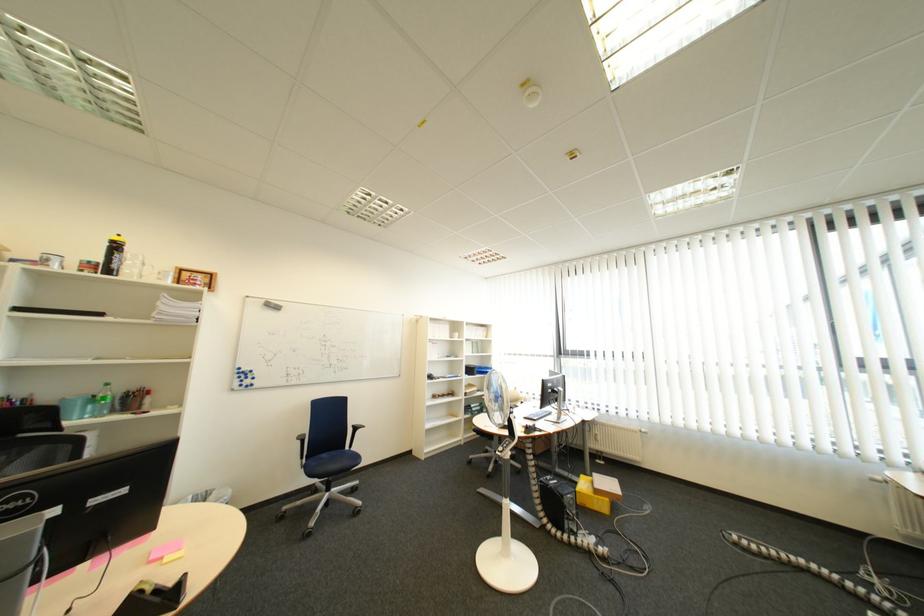
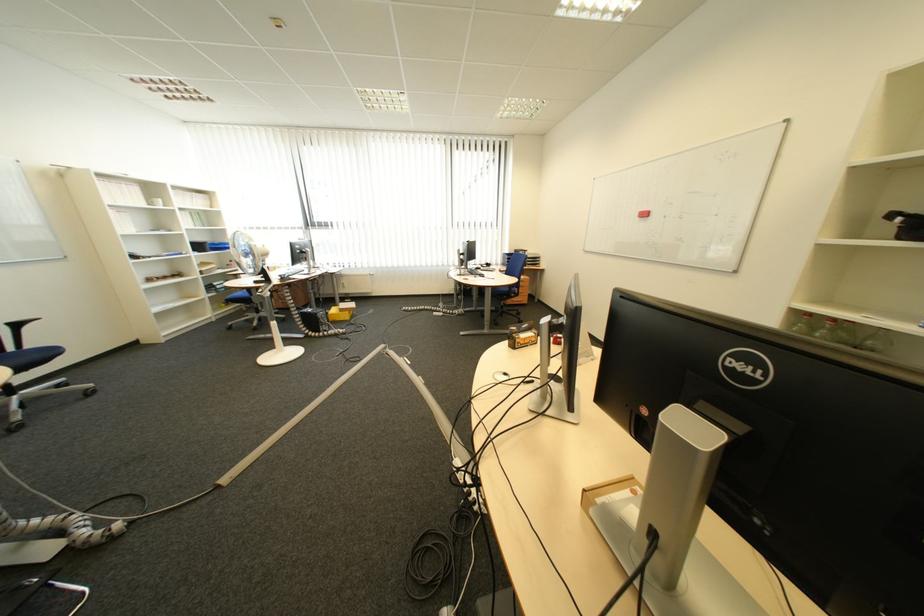
Where in the second image is the point corresponding to [585,503] from the first image?

(335, 317)